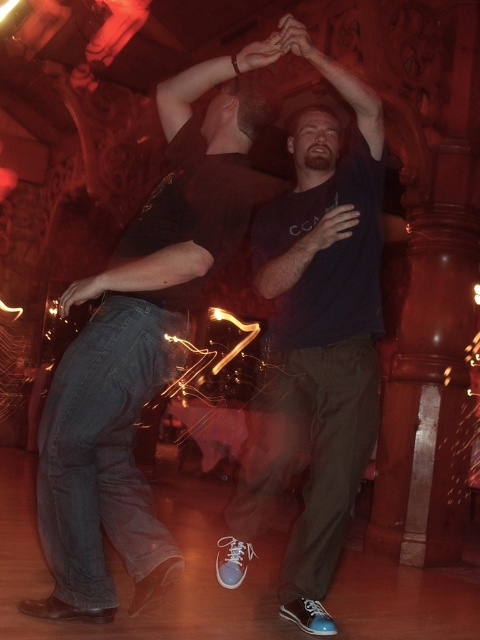
Between jeans at left and dark blue t-shirt at center, which one has less height?

jeans at left is shorter.

This screenshot has width=480, height=640. In order to click on jeans at left in this screenshot , I will do `click(134, 371)`.

Locate an element on the screen. jeans at left is located at coordinates (134, 371).